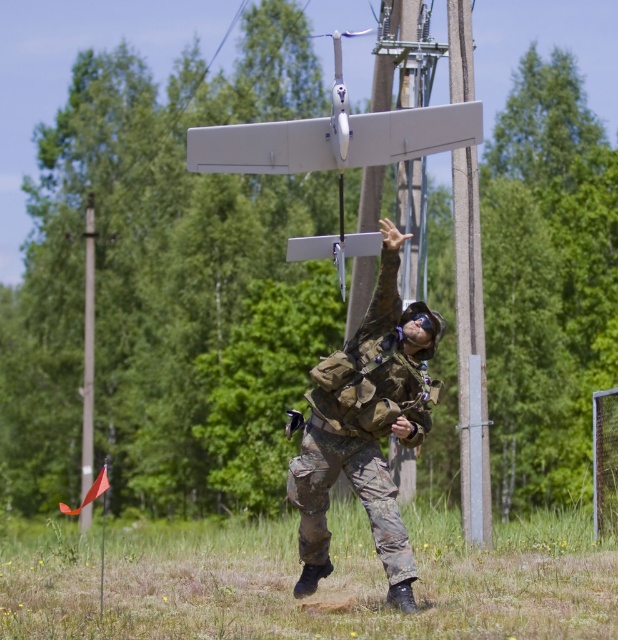
Question: From the image, what is the correct spatial relationship of camouflage fabric uniform at center in relation to smooth gray telegraph pole at center?

Choices:
 (A) right
 (B) left

Answer: (B)

Question: Is camouflage fabric uniform at center below smooth gray telegraph pole at center?

Choices:
 (A) yes
 (B) no

Answer: (A)

Question: Among these objects, which one is farthest from the camera?

Choices:
 (A) smooth gray telegraph pole at center
 (B) camouflage fabric uniform at center

Answer: (A)

Question: Which point appears closest to the camera in this image?

Choices:
 (A) (310, 516)
 (B) (467, 480)

Answer: (A)

Question: Is camouflage fabric uniform at center positioned at the back of smooth gray telegraph pole at center?

Choices:
 (A) yes
 (B) no

Answer: (B)

Question: Which of the following is the closest to the observer?

Choices:
 (A) (470, 353)
 (B) (386, 305)

Answer: (B)